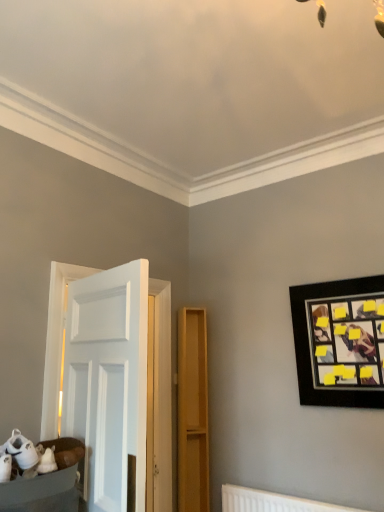
Question: Can white plastic radiator at lower center be found inside black matte picture frame at upper right?

Choices:
 (A) yes
 (B) no

Answer: (B)

Question: Is black matte picture frame at upper right aimed at white plastic radiator at lower center?

Choices:
 (A) yes
 (B) no

Answer: (B)

Question: Is black matte picture frame at upper right closer to the viewer compared to white plastic radiator at lower center?

Choices:
 (A) no
 (B) yes

Answer: (A)

Question: Can you confirm if black matte picture frame at upper right is taller than white plastic radiator at lower center?

Choices:
 (A) yes
 (B) no

Answer: (A)

Question: Is black matte picture frame at upper right completely or partially outside of white plastic radiator at lower center?

Choices:
 (A) no
 (B) yes

Answer: (B)

Question: Looking at the image, does white plastic radiator at lower center seem bigger or smaller compared to white fabric basket at lower left?

Choices:
 (A) small
 (B) big

Answer: (A)

Question: Considering their positions, is white plastic radiator at lower center located in front of or behind white fabric basket at lower left?

Choices:
 (A) behind
 (B) front

Answer: (A)

Question: From a real-world perspective, is white plastic radiator at lower center positioned above or below white fabric basket at lower left?

Choices:
 (A) above
 (B) below

Answer: (B)

Question: Is point (294, 509) closer or farther from the camera than point (67, 461)?

Choices:
 (A) farther
 (B) closer

Answer: (A)

Question: Is black matte picture frame at upper right wider or thinner than white plastic radiator at lower center?

Choices:
 (A) wide
 (B) thin

Answer: (A)

Question: Is black matte picture frame at upper right to the left or to the right of white plastic radiator at lower center in the image?

Choices:
 (A) right
 (B) left

Answer: (A)

Question: Which is correct: black matte picture frame at upper right is inside white plastic radiator at lower center, or outside of it?

Choices:
 (A) outside
 (B) inside

Answer: (A)

Question: From a real-world perspective, is black matte picture frame at upper right above or below white plastic radiator at lower center?

Choices:
 (A) below
 (B) above

Answer: (B)

Question: Is white fabric basket at lower left bigger or smaller than black matte picture frame at upper right?

Choices:
 (A) small
 (B) big

Answer: (A)

Question: Is white fabric basket at lower left taller or shorter than black matte picture frame at upper right?

Choices:
 (A) short
 (B) tall

Answer: (A)